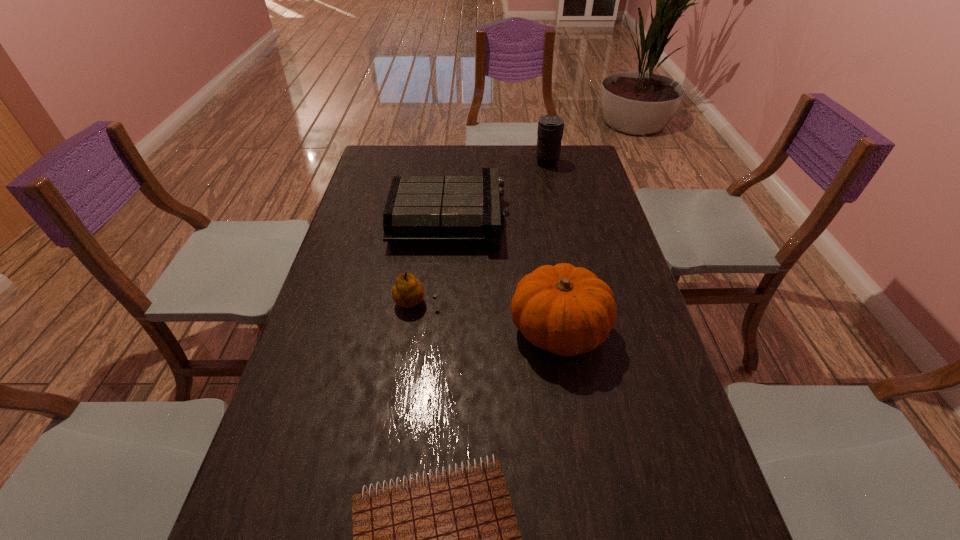
What are the coordinates of `free spot between the pumpkin and the pear` in the screenshot? It's located at (488, 316).

Identify the location of vacant area that lies between the pear and the pumpkin. The image size is (960, 540). (488, 316).

Find the location of a particular element. unoccupied area between the radio receiver and the pear is located at coordinates (432, 261).

Select which object is the fourth closest to the pumpkin. Please provide its 2D coordinates. Your answer should be formatted as a tuple, i.e. [(x, y)], where the tuple contains the x and y coordinates of a point satisfying the conditions above.

[(550, 127)]

Where is `the fourth closest object to the pear`? This screenshot has height=540, width=960. the fourth closest object to the pear is located at coordinates (550, 127).

You are a GUI agent. You are given a task and a screenshot of the screen. Output one action in this format:
    pyautogui.click(x=<x>, y=<y>)
    Task: Click on the free space that satisfies the following two spatial constraints: 1. on the side of the telephoto lens where the control switches are located; 2. on the front side of the pumpkin
    The height and width of the screenshot is (540, 960).
    Given the screenshot: What is the action you would take?
    pyautogui.click(x=582, y=329)

At what (x,y) coordinates should I click in order to perform the action: click on free point that satisfies the following two spatial constraints: 1. on the front panel of the second farthest object; 2. on the right side of the pumpkin. Please return your answer as a coordinate pair (x, y). The image size is (960, 540). Looking at the image, I should click on (440, 329).

The height and width of the screenshot is (540, 960). Find the location of `free space that satisfies the following two spatial constraints: 1. on the side of the telephoto lens where the control switches are located; 2. on the front side of the pumpkin`. free space that satisfies the following two spatial constraints: 1. on the side of the telephoto lens where the control switches are located; 2. on the front side of the pumpkin is located at coordinates (582, 329).